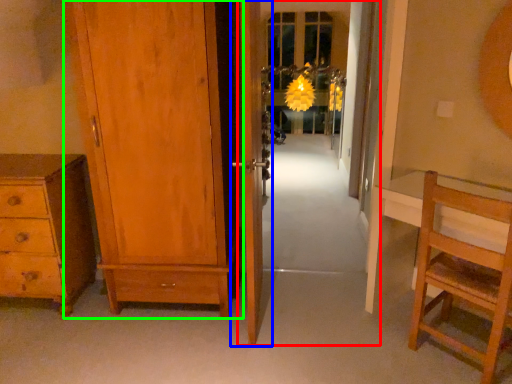
Question: Which object is the farthest from screen door (highlighted by a red box)? Choose among these: door (highlighted by a blue box) or door (highlighted by a green box).

Choices:
 (A) door
 (B) door

Answer: (B)